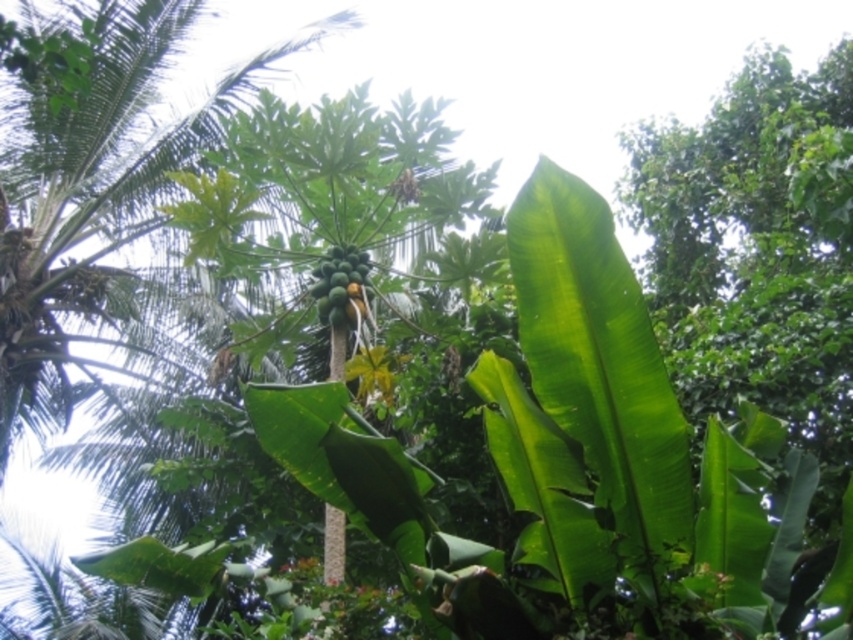
Question: Considering the real-world distances, which object is closest to the green matte papaya at center?

Choices:
 (A) green leafy palm tree at center
 (B) green matte coconut tree at center

Answer: (B)

Question: Does green leafy palm tree at center appear over green matte coconut tree at center?

Choices:
 (A) no
 (B) yes

Answer: (B)

Question: Which point is closer to the camera?

Choices:
 (A) (361, 266)
 (B) (100, 636)
 (C) (392, 458)

Answer: (C)

Question: Does green matte coconut tree at center have a larger size compared to green matte papaya at center?

Choices:
 (A) yes
 (B) no

Answer: (B)

Question: Is green leafy palm tree at center positioned at the back of green matte coconut tree at center?

Choices:
 (A) yes
 (B) no

Answer: (B)

Question: Among these objects, which one is nearest to the camera?

Choices:
 (A) green matte papaya at center
 (B) green leafy palm tree at center

Answer: (B)